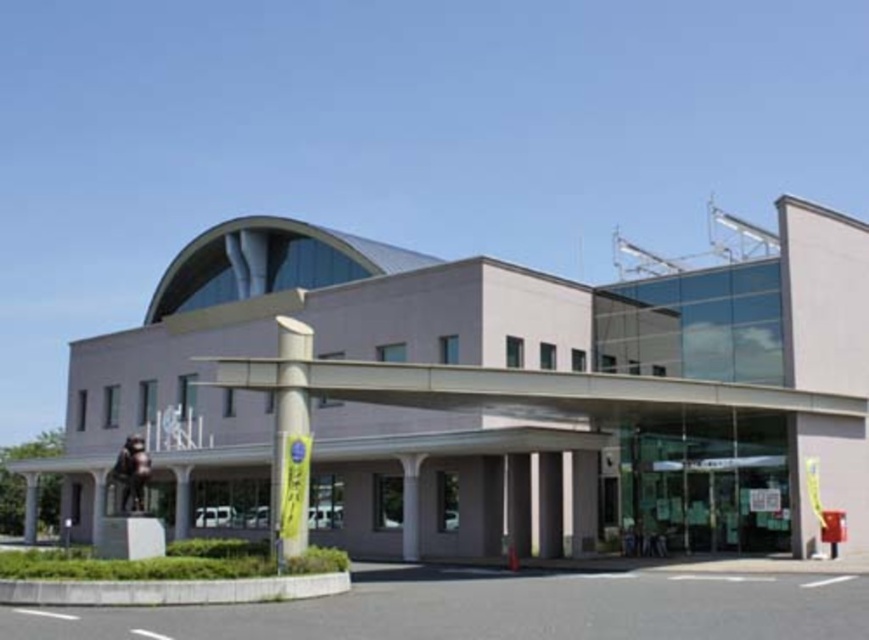
Which is behind, point (304, 435) or point (184, 531)?

The point (184, 531) is more distant.

Between point (302, 532) and point (177, 497), which one is positioned behind?

The point (177, 497) is behind.

Image resolution: width=869 pixels, height=640 pixels. Find the location of `white glossy pillar at center`. white glossy pillar at center is located at coordinates (290, 440).

Identify the location of white smooth column at center. This screenshot has width=869, height=640. (410, 506).

Who is positioned more to the right, white smooth column at center or gray concrete pillar at lower left?

Positioned to the right is white smooth column at center.

Is point (403, 497) more distant than point (30, 483)?

That is False.

The image size is (869, 640). What are the coordinates of `white smooth column at center` in the screenshot? It's located at (410, 506).

Between white smooth column at center and smooth concrete pillar at center, which one has less height?

smooth concrete pillar at center

Is point (416, 524) positioned in front of point (181, 520)?

That is True.

Describe the element at coordinates (410, 506) in the screenshot. I see `white smooth column at center` at that location.

Locate an element on the screen. This screenshot has width=869, height=640. white smooth column at center is located at coordinates click(410, 506).